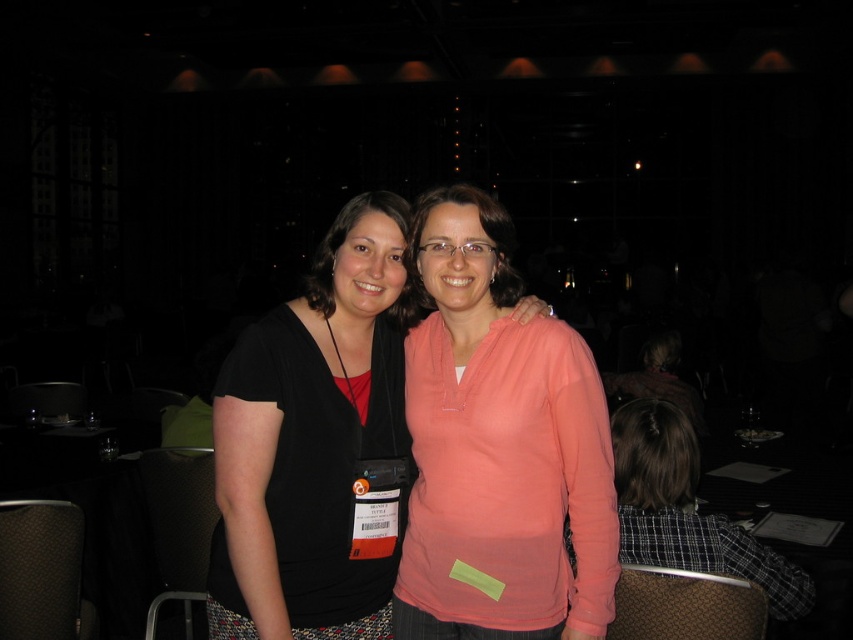
In the image, there is a person on the left wearing a black top over a red shirt and patterned pants, and a person on the right in a coral long sleeve top and dark pants. Both have name tags. There is also a point marked at coordinates (x=498, y=449). What object is located at that point?

The point at (x=498, y=449) marks the location of the matte pink hoodie at center.

You are organizing a clothing donation drive and need to categorize items by size. You have two items in front of you, the matte pink hoodie at center and the matte black shirt at center. Based on their sizes, which one should you place in the large bin?

The matte pink hoodie at center is bigger than the matte black shirt at center, so it should be placed in the large bin.